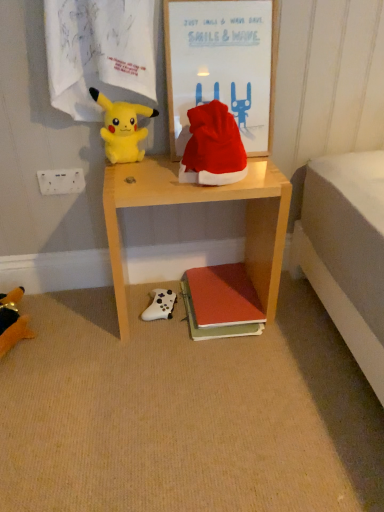
Identify the location of free space in front of matte orange book at lower center. The height and width of the screenshot is (512, 384). (236, 366).